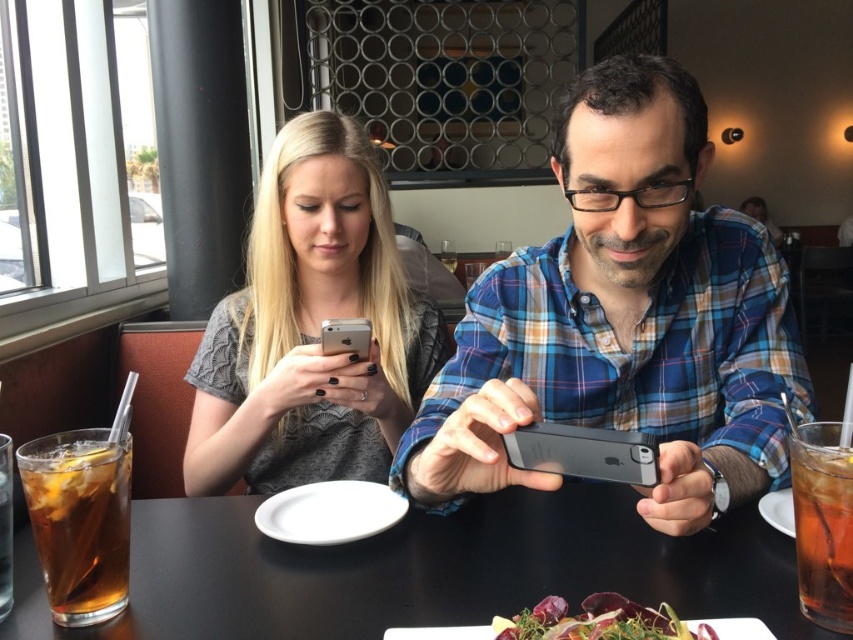
You are a waiter in this restaurant and need to place a new drink order on the table. Considering the green leafy salad at lower center and the silver metallic smartphone at center, where should you place the drink to ensure it doesn

The green leafy salad at lower center is shorter than the silver metallic smartphone at center, so placing the drink between them would allow it to be visible and accessible without blocking the salad or the smartphone.

Based on the photo, you are a waiter in a restaurant and need to place a new dish on the table between the matte black phone at center and the green leafy salad at lower center. Can you do this without moving either object?

The matte black phone at center is further to the viewer than the green leafy salad at lower center, so there is space between them for placing the dish without moving either object.